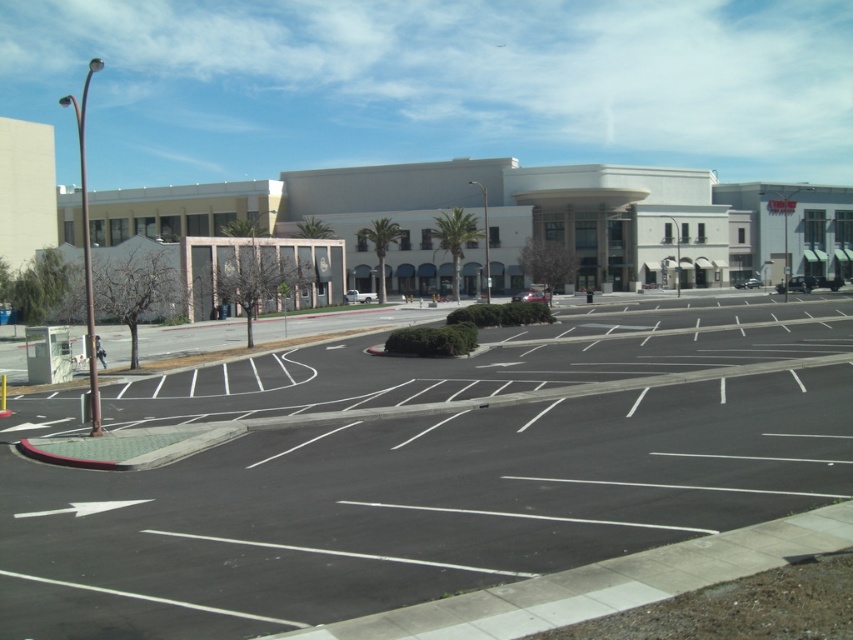
Can you confirm if black asphalt parking lot at center is positioned to the right of white smooth building at center?

In fact, black asphalt parking lot at center is to the left of white smooth building at center.

Image resolution: width=853 pixels, height=640 pixels. What do you see at coordinates (426, 470) in the screenshot?
I see `black asphalt parking lot at center` at bounding box center [426, 470].

The width and height of the screenshot is (853, 640). What are the coordinates of `black asphalt parking lot at center` in the screenshot? It's located at (426, 470).